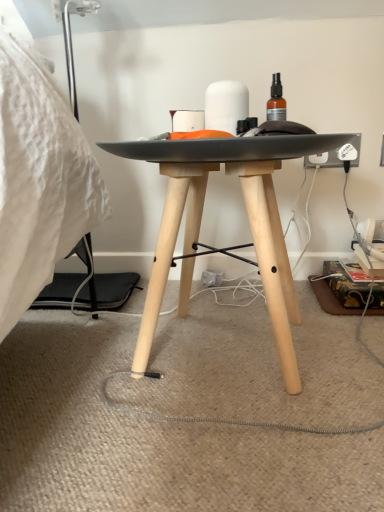
The height and width of the screenshot is (512, 384). Describe the element at coordinates (214, 418) in the screenshot. I see `black cord at lower center` at that location.

What is the approximate width of black cord at lower center?

The width of black cord at lower center is 4.06 feet.

Where is `black cord at lower center`? The image size is (384, 512). black cord at lower center is located at coordinates [x=214, y=418].

In order to click on white matte cylinder at center in this screenshot , I will do `click(226, 105)`.

In order to face white matte cylinder at center, should I rotate leftwards or rightwards?

Rotate right and turn 4.426 degrees.

What do you see at coordinates (226, 105) in the screenshot? The width and height of the screenshot is (384, 512). I see `white matte cylinder at center` at bounding box center [226, 105].

You are a GUI agent. You are given a task and a screenshot of the screen. Output one action in this format:
    pyautogui.click(x=<x>, y=<y>)
    Task: Click on the black cord at lower center
    The image size is (384, 512).
    Given the screenshot: What is the action you would take?
    pyautogui.click(x=214, y=418)

Is black cord at lower center to the left or to the right of white matte cylinder at center in the image?

Based on their positions, black cord at lower center is located to the left of white matte cylinder at center.

Who is more distant, black cord at lower center or white matte cylinder at center?

white matte cylinder at center is further from the camera.

Which is in front, point (375, 425) or point (230, 100)?

Positioned in front is point (375, 425).

From the image's perspective, is black cord at lower center above or below white matte cylinder at center?

Clearly, from the image's perspective, black cord at lower center is below white matte cylinder at center.

From a real-world perspective, which is physically below, black cord at lower center or white matte cylinder at center?

black cord at lower center is physically lower.

Which object is thinner, black cord at lower center or white matte cylinder at center?

white matte cylinder at center is thinner.

In terms of height, does black cord at lower center look taller or shorter compared to white matte cylinder at center?

Considering their sizes, black cord at lower center has less height than white matte cylinder at center.

Which of these two, black cord at lower center or white matte cylinder at center, is smaller?

white matte cylinder at center.

Is black cord at lower center inside the boundaries of white matte cylinder at center, or outside?

black cord at lower center is outside white matte cylinder at center.

Are black cord at lower center and white matte cylinder at center located far from each other?

No, black cord at lower center is not far away from white matte cylinder at center.

Does black cord at lower center turn towards white matte cylinder at center?

No, black cord at lower center is not aimed at white matte cylinder at center.

How different are the orientations of black cord at lower center and white matte cylinder at center in degrees?

There is a 89.9-degree angle between the facing directions of black cord at lower center and white matte cylinder at center.

Identify the location of string on the left of white matte cylinder at center. (214, 418).

Which is more to the right, white matte cylinder at center or black cord at lower center?

white matte cylinder at center is more to the right.

Is white matte cylinder at center behind black cord at lower center?

Yes, the depth of white matte cylinder at center is greater than that of black cord at lower center.

Considering the positions of points (211, 119) and (368, 348), is point (211, 119) farther from camera compared to point (368, 348)?

That is False.

Based on the photo, from the image's perspective, is white matte cylinder at center beneath black cord at lower center?

No.

From a real-world perspective, is white matte cylinder at center on top of black cord at lower center?

Indeed, from a real-world perspective, white matte cylinder at center stands above black cord at lower center.

Is white matte cylinder at center wider or thinner than black cord at lower center?

white matte cylinder at center is thinner than black cord at lower center.

Considering the sizes of objects white matte cylinder at center and black cord at lower center in the image provided, who is shorter, white matte cylinder at center or black cord at lower center?

black cord at lower center.

Considering the sizes of white matte cylinder at center and black cord at lower center in the image, is white matte cylinder at center bigger or smaller than black cord at lower center?

In the image, white matte cylinder at center appears to be smaller than black cord at lower center.

Is white matte cylinder at center positioned beyond the bounds of black cord at lower center?

Yes.

Does white matte cylinder at center touch black cord at lower center?

There is a gap between white matte cylinder at center and black cord at lower center.

Is white matte cylinder at center turned away from black cord at lower center?

No, black cord at lower center is not at the back of white matte cylinder at center.

Where is `string that is in front of the white matte cylinder at center`? string that is in front of the white matte cylinder at center is located at coordinates (214, 418).

The height and width of the screenshot is (512, 384). Find the location of `toilet paper located on the right of black cord at lower center`. toilet paper located on the right of black cord at lower center is located at coordinates (226, 105).

Identify the location of string below the white matte cylinder at center (from a real-world perspective). This screenshot has width=384, height=512. (214, 418).